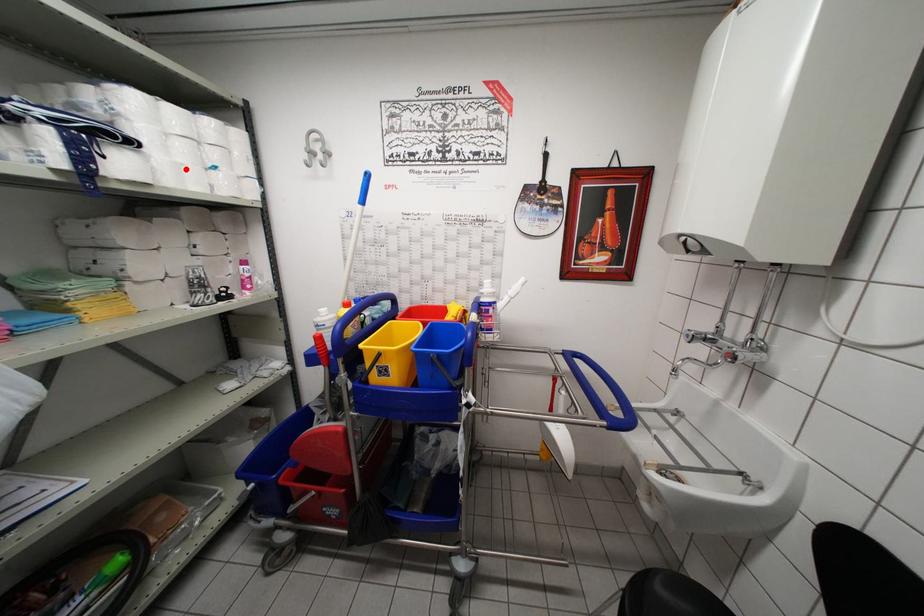
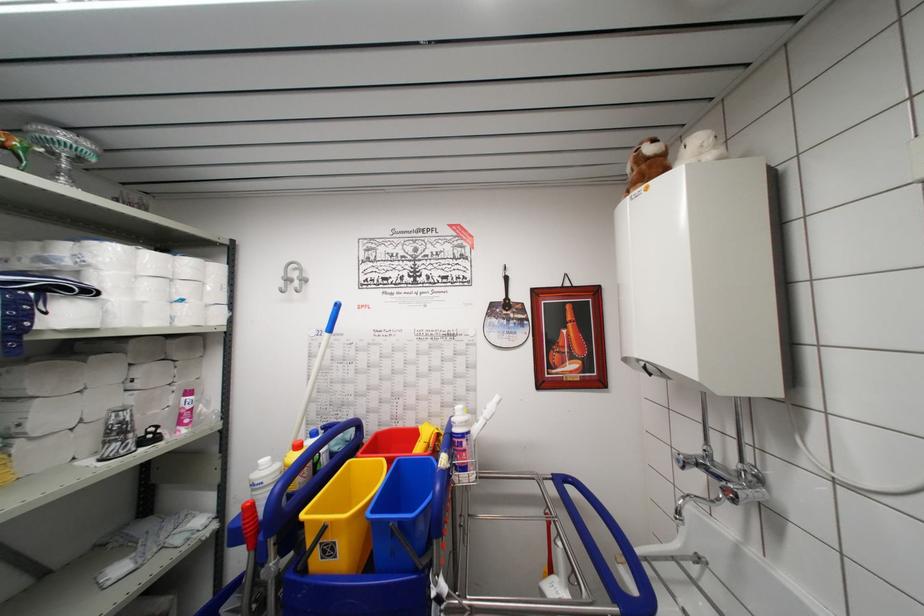
Find the pixel in the second image that matches the highlighted location in the first image.

(149, 307)